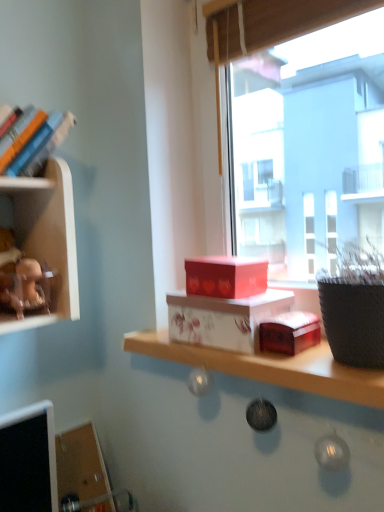
Question: From a real-world perspective, is white glossy box at center physically located above or below transparent glass window at center?

Choices:
 (A) below
 (B) above

Answer: (A)

Question: Considering the relative positions of white glossy box at center and transparent glass window at center in the image provided, is white glossy box at center to the left or to the right of transparent glass window at center?

Choices:
 (A) right
 (B) left

Answer: (B)

Question: Which is farther from the hardcover books at left?

Choices:
 (A) white glossy box at center
 (B) transparent glass window at center
 (C) matte brown figurine at upper left

Answer: (B)

Question: Which object is the farthest from the transparent glass window at center?

Choices:
 (A) white glossy box at center
 (B) hardcover books at left
 (C) matte brown figurine at upper left

Answer: (C)